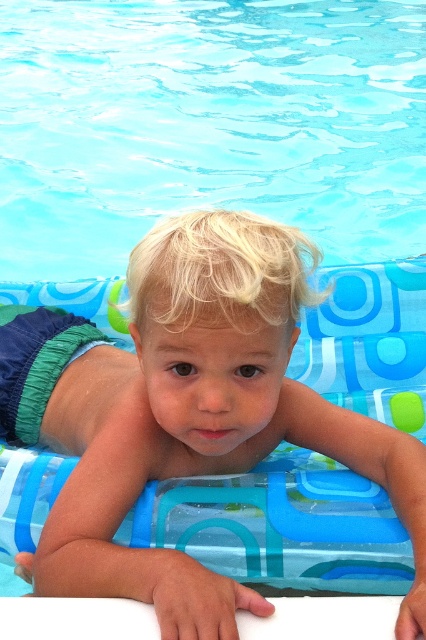
Who is more distant from viewer, (339,196) or (71,556)?

Positioned behind is point (339,196).

Between point (74, 262) and point (221, 236), which one is positioned behind?

Point (74, 262)

The width and height of the screenshot is (426, 640). In order to click on transparent plastic pool at upper center in this screenshot , I will do `click(207, 124)`.